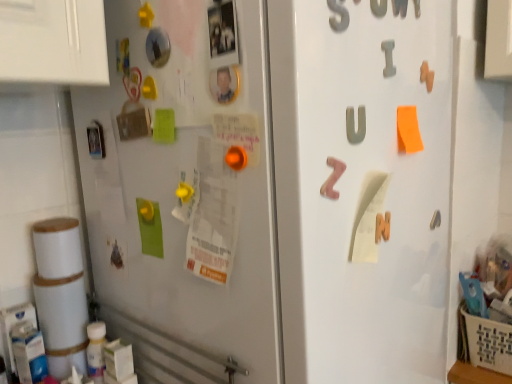
Question: Choose the correct answer: Is metallic gray letter at upper right, which is the 1th number in front-to-back order, inside pink foam letter z at center, the third alphabet when ordered from right to left, or outside it?

Choices:
 (A) outside
 (B) inside

Answer: (A)

Question: Looking at the image, does metallic gray letter at upper right, which is the 1th number in front-to-back order, seem bigger or smaller compared to pink foam letter z at center, the third alphabet when ordered from right to left?

Choices:
 (A) big
 (B) small

Answer: (B)

Question: Estimate the real-world distances between objects in this image. Which object is closer to the matte gray letter u at center, the 2th alphabet ordered from the bottom?

Choices:
 (A) beige woven basket at lower right
 (B) metallic gray letter at upper center, the first number from the back
 (C) metallic gray letter at upper right, the first number in the left-to-right sequence
 (D) gray matte letter i at upper right, acting as the third alphabet starting from the bottom
 (E) white paper at center right

Answer: (D)

Question: Considering the real-world distances, which object is farthest from the metallic gray letter at upper right, acting as the second number starting from the back?

Choices:
 (A) white paper at center right
 (B) beige woven basket at lower right
 (C) gray matte letter i at upper right, the first alphabet in the back-to-front sequence
 (D) pink foam letter z at center, acting as the 1th alphabet starting from the left
 (E) metallic gray letter at upper center, which is the second number from front to back

Answer: (B)